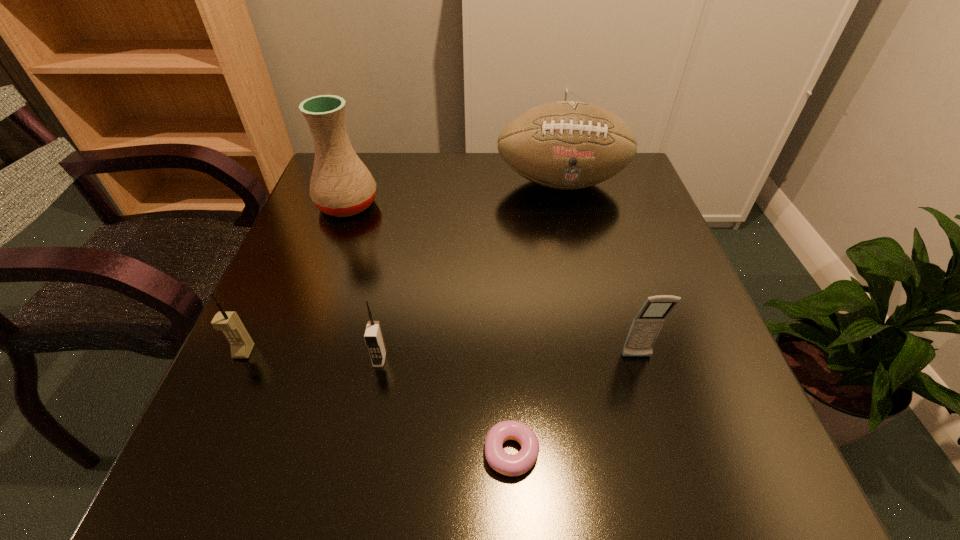
At what (x,y) coordinates should I click in order to perform the action: click on pottery. Please return your answer as a coordinate pair (x, y). Looking at the image, I should click on (341, 185).

What are the coordinates of `football (American)` in the screenshot? It's located at (566, 145).

Locate an element on the screen. The image size is (960, 540). the rightmost cellular telephone is located at coordinates (646, 325).

Find the location of a particular element. This screenshot has width=960, height=540. the leftmost cellular telephone is located at coordinates (241, 344).

The height and width of the screenshot is (540, 960). Identify the location of the second cellular telephone from left to right. (373, 336).

This screenshot has width=960, height=540. I want to click on the nearest object, so click(517, 464).

Locate an element on the screen. The height and width of the screenshot is (540, 960). doughnut is located at coordinates (517, 464).

The width and height of the screenshot is (960, 540). I want to click on free location located on the right of the pottery, so click(x=423, y=205).

You are a GUI agent. You are given a task and a screenshot of the screen. Output one action in this format:
    pyautogui.click(x=<x>, y=<y>)
    Task: Click on the vacant space located on the laces of the football (American)
    
    Given the screenshot: What is the action you would take?
    pyautogui.click(x=573, y=232)

Locate an element on the screen. The image size is (960, 540). vacant space located on the front-facing side of the rightmost cellular telephone is located at coordinates (679, 496).